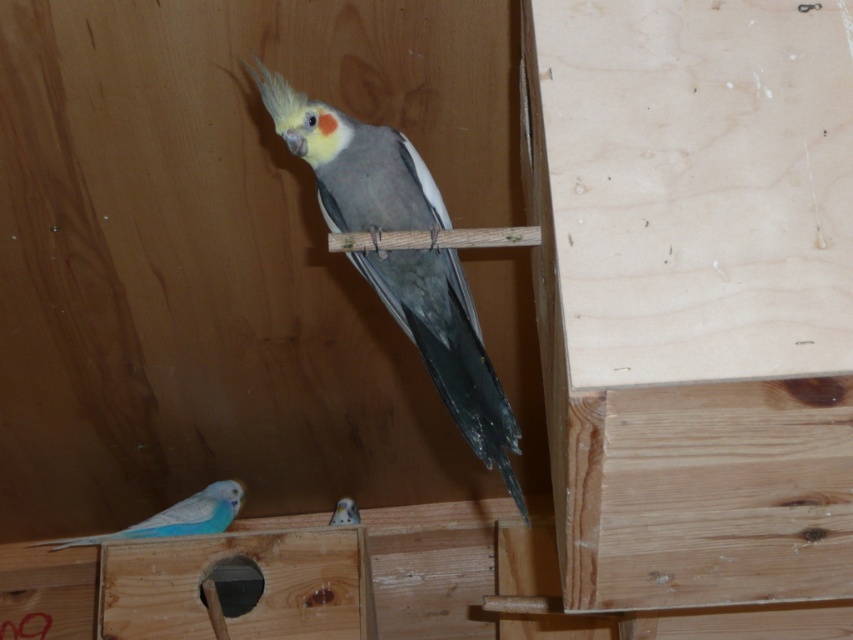
What do you see at coordinates (177, 516) in the screenshot?
I see `blue glossy parakeet at lower left` at bounding box center [177, 516].

Where is `blue glossy parakeet at lower left`? blue glossy parakeet at lower left is located at coordinates (177, 516).

Which is above, gray matte parrot at center or blue glossy parakeet at lower left?

gray matte parrot at center is above.

Can you confirm if gray matte parrot at center is bigger than blue glossy parakeet at lower left?

Yes.

Between point (486, 400) and point (236, 490), which one is positioned in front?

Point (486, 400)

Where is `gray matte parrot at center`? This screenshot has height=640, width=853. gray matte parrot at center is located at coordinates (402, 257).

Between gray matte parrot at center and matte blue parrot at lower left, which one has less height?

Standing shorter between the two is matte blue parrot at lower left.

Does point (354, 214) come closer to viewer compared to point (335, 513)?

Yes.

Is point (442, 387) farther from viewer compared to point (339, 524)?

No.

The width and height of the screenshot is (853, 640). What are the coordinates of `gray matte parrot at center` in the screenshot? It's located at (402, 257).